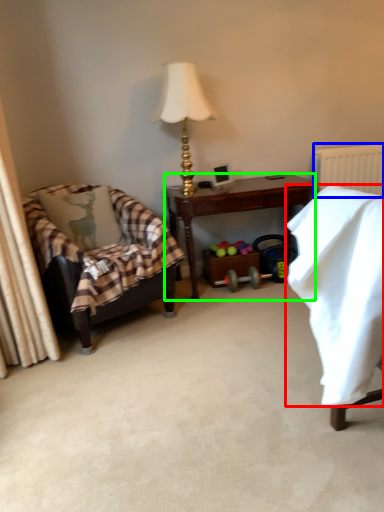
Question: Based on their relative distances, which object is farther from blanket (highlighted by a red box)? Choose from radiator (highlighted by a blue box) and desk (highlighted by a green box).

Choices:
 (A) radiator
 (B) desk

Answer: (A)